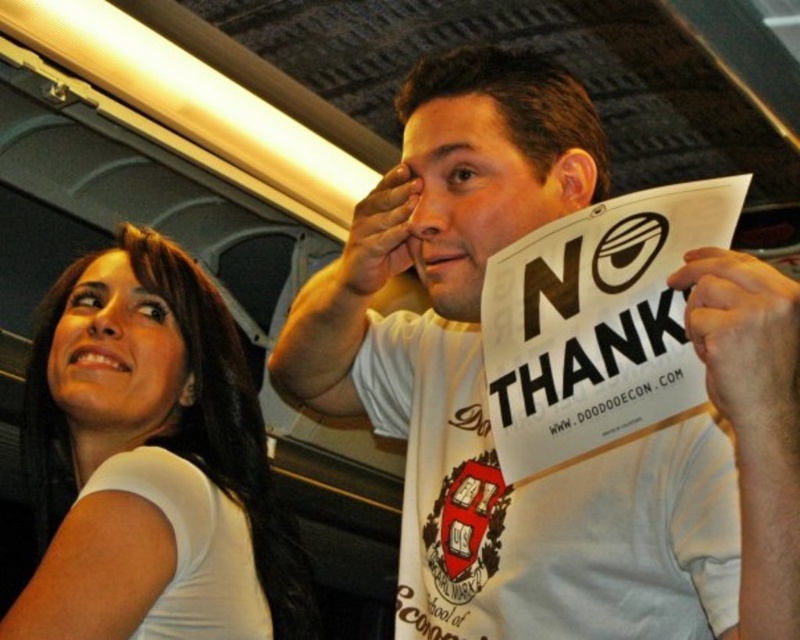
Question: Does white cotton t-shirt at center appear over white matte shirt at upper left?

Choices:
 (A) no
 (B) yes

Answer: (B)

Question: Among these objects, which one is nearest to the camera?

Choices:
 (A) white cotton t-shirt at center
 (B) white matte shirt at upper left

Answer: (A)

Question: Does white cotton t-shirt at center appear over white matte shirt at upper left?

Choices:
 (A) yes
 (B) no

Answer: (A)

Question: Among these points, which one is nearest to the camera?

Choices:
 (A) (220, 448)
 (B) (404, 241)

Answer: (B)

Question: Is white cotton t-shirt at center closer to camera compared to white matte shirt at upper left?

Choices:
 (A) yes
 (B) no

Answer: (A)

Question: Which object is closer to the camera taking this photo?

Choices:
 (A) white cotton t-shirt at center
 (B) white matte shirt at upper left

Answer: (A)